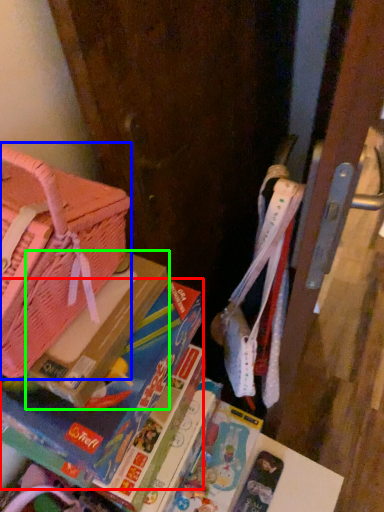
Question: Considering the real-world distances, which object is closest to book (highlighted by a red box)? handbag (highlighted by a blue box) or paperback book (highlighted by a green box).

Choices:
 (A) handbag
 (B) paperback book

Answer: (B)